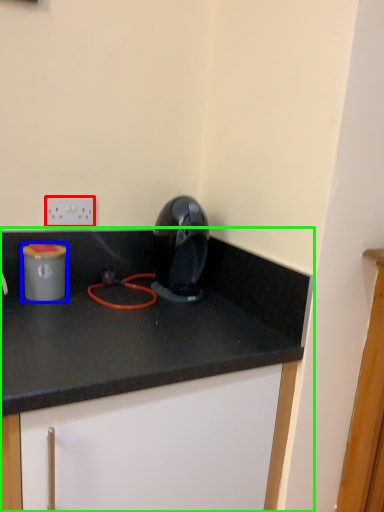
Question: Estimate the real-world distances between objects in this image. Which object is farther from electric outlet (highlighted by a red box), appliance (highlighted by a blue box) or cabinetry (highlighted by a green box)?

Choices:
 (A) appliance
 (B) cabinetry

Answer: (B)